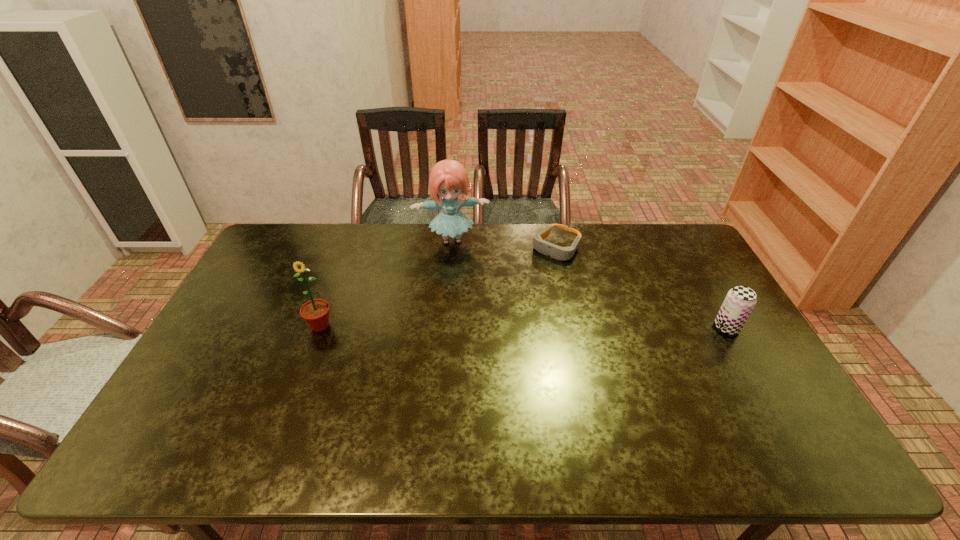
In order to click on free space between the leftmost object and the second object from right to left in this screenshot , I will do `click(439, 287)`.

At what (x,y) coordinates should I click in order to perform the action: click on vacant area that lies between the tallest object and the third shortest object. Please return your answer as a coordinate pair (x, y). This screenshot has height=540, width=960. Looking at the image, I should click on (386, 283).

Where is `empty space that is in between the doll and the leftmost object`? The image size is (960, 540). empty space that is in between the doll and the leftmost object is located at coordinates (386, 283).

Identify the location of free space between the second shortest object and the tallest object. (589, 284).

The width and height of the screenshot is (960, 540). Find the location of `empty location between the doll and the second shortest object`. empty location between the doll and the second shortest object is located at coordinates (589, 284).

Locate which object is the third closest to the leftmost object. Please provide its 2D coordinates. Your answer should be formatted as a tuple, i.e. [(x, y)], where the tuple contains the x and y coordinates of a point satisfying the conditions above.

[(740, 300)]

Image resolution: width=960 pixels, height=540 pixels. Identify the location of object that stands as the closest to the beer can. (557, 252).

At what (x,y) coordinates should I click in order to perform the action: click on free space that satisfies the following two spatial constraints: 1. on the face of the beer can; 2. on the left side of the sunflower. Please return your answer as a coordinate pair (x, y). Looking at the image, I should click on (320, 327).

I want to click on blank area in the image that satisfies the following two spatial constraints: 1. on the front side of the doll; 2. on the left side of the beer can, so click(444, 327).